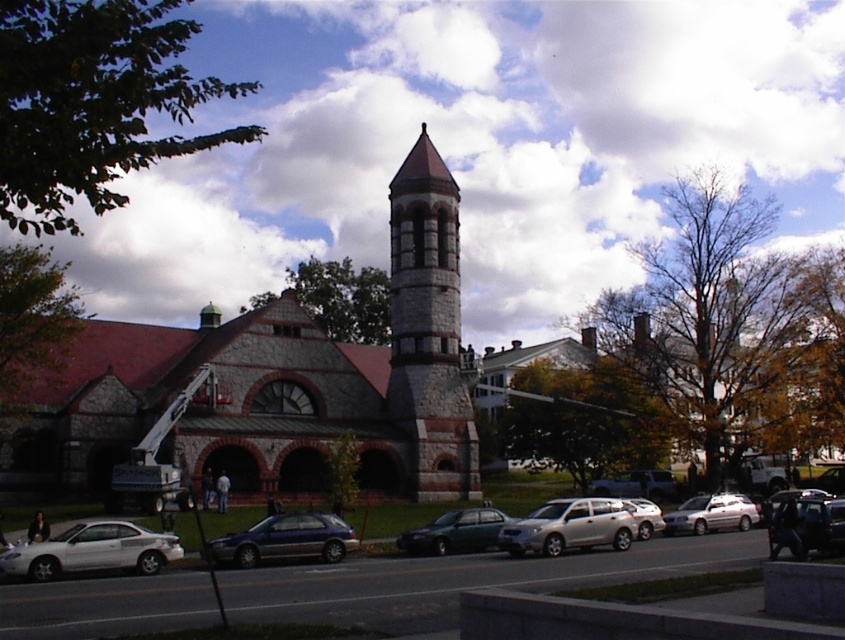
Question: Which point is closer to the camera?

Choices:
 (A) (720, 525)
 (B) (472, 513)

Answer: (B)

Question: Does stone brick tower at center have a greater width compared to satin silver suv at center?

Choices:
 (A) yes
 (B) no

Answer: (A)

Question: Which object appears farthest from the camera in this image?

Choices:
 (A) shiny black suv at center
 (B) satin silver suv at center
 (C) stone brick tower at center
 (D) white glossy sedan at lower left

Answer: (B)

Question: Can you confirm if stone tower at center is positioned below shiny black suv at center?

Choices:
 (A) no
 (B) yes

Answer: (A)

Question: Among these objects, which one is nearest to the camera?

Choices:
 (A) shiny black suv at center
 (B) metallic blue sedan at center
 (C) stone brick tower at center
 (D) stone tower at center

Answer: (A)

Question: Does stone tower at center have a lesser width compared to shiny black suv at center?

Choices:
 (A) yes
 (B) no

Answer: (B)